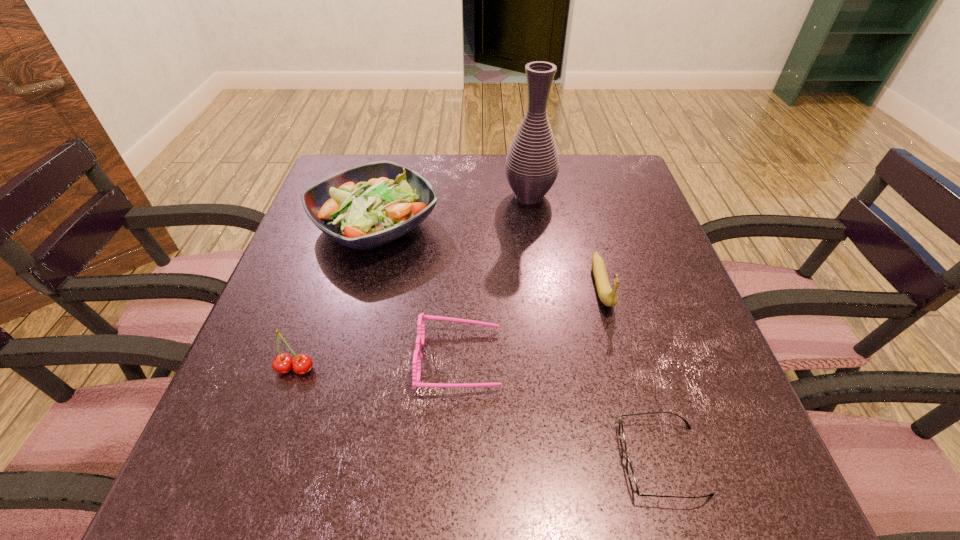
Identify the location of salad plate that is at the left edge. (368, 205).

Where is `cherry located in the left edge section of the desktop`? The width and height of the screenshot is (960, 540). cherry located in the left edge section of the desktop is located at coordinates (283, 363).

Where is `banana located at the right edge`? Image resolution: width=960 pixels, height=540 pixels. banana located at the right edge is located at coordinates (608, 297).

Identify the location of spectacles that is at the right edge. (x=630, y=472).

Find the location of a particular element. object located in the far left corner section of the desktop is located at coordinates (368, 205).

You are a GUI agent. You are given a task and a screenshot of the screen. Output one action in this format:
    pyautogui.click(x=<x>, y=<y>)
    Task: Click on the object present at the near right corner
    
    Given the screenshot: What is the action you would take?
    pyautogui.click(x=630, y=472)

Image resolution: width=960 pixels, height=540 pixels. In the image, there is a desktop. Find the location of `free space at the far edge`. free space at the far edge is located at coordinates (497, 202).

Find the location of a particular element. free space at the near edge of the desktop is located at coordinates (377, 458).

In the image, there is a desktop. Where is `free region at the left edge`? free region at the left edge is located at coordinates (290, 338).

In the image, there is a desktop. At what (x,y) coordinates should I click in order to perform the action: click on vacant space at the right edge. Please return your answer as a coordinate pair (x, y). This screenshot has width=960, height=540. Looking at the image, I should click on (659, 289).